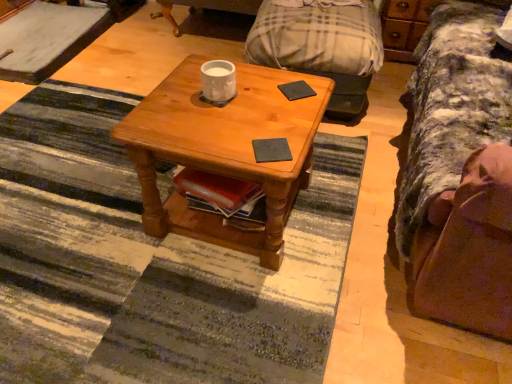
Image resolution: width=512 pixels, height=384 pixels. I want to click on unoccupied space behind black matte pad at center, arranged as the 1th pad when viewed from the front, so pyautogui.click(x=271, y=119).